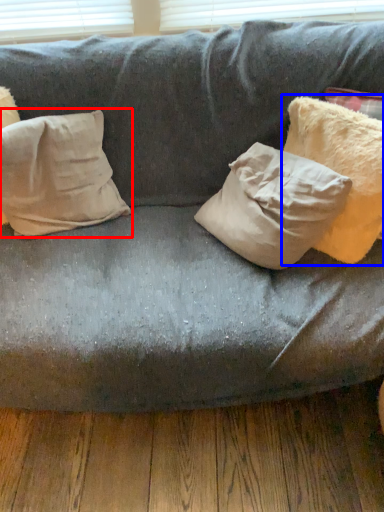
Question: Which object is closer to the camera taking this photo, pillow (highlighted by a red box) or pillow (highlighted by a blue box)?

Choices:
 (A) pillow
 (B) pillow

Answer: (B)